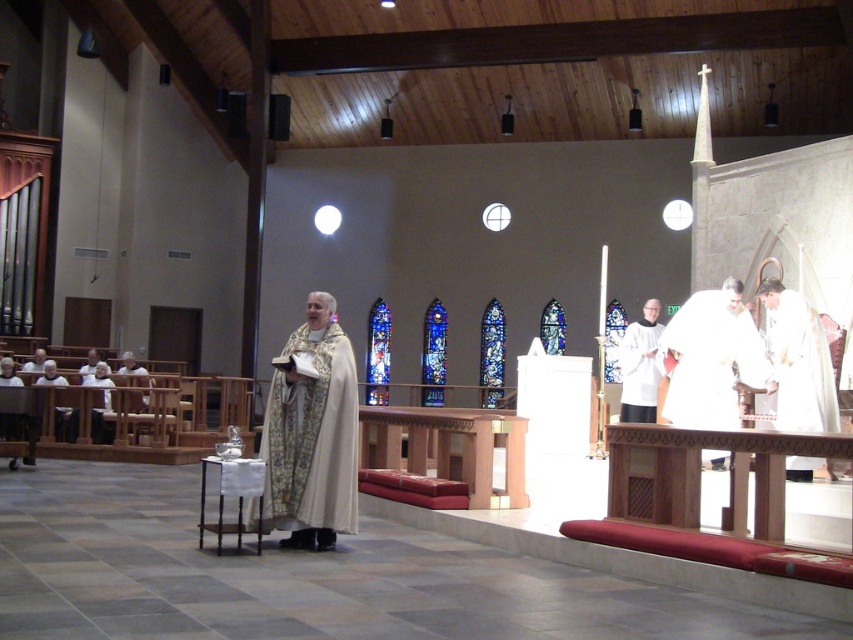
How much distance is there between white clothed figure at right and wooden altar at center?

3.03 meters

Is point (738, 340) positioned behind point (515, 432)?

No, it is not.

Locate an element on the screen. The width and height of the screenshot is (853, 640). white clothed figure at right is located at coordinates (711, 358).

You are a GUI agent. You are given a task and a screenshot of the screen. Output one action in this format:
    pyautogui.click(x=<x>, y=<y>)
    Task: Click on the white clothed figure at right
    This screenshot has width=853, height=640.
    Given the screenshot: What is the action you would take?
    pyautogui.click(x=711, y=358)

Between wooden altar at center and white cloth at right, which one appears on the left side from the viewer's perspective?

wooden altar at center

Does wooden altar at center have a larger size compared to white cloth at right?

Yes, wooden altar at center is bigger than white cloth at right.

Where is `wooden altar at center`? wooden altar at center is located at coordinates (450, 448).

Who is positioned more to the right, white cloth at right or silk white robe at lower left?

white cloth at right

Does point (808, 401) come closer to viewer compared to point (44, 368)?

Yes.

Where is `white cloth at right`? white cloth at right is located at coordinates (798, 362).